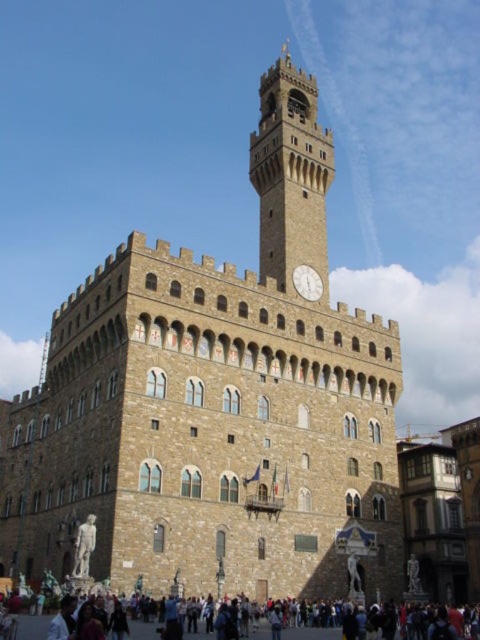
Looking at this image, can you confirm if brown stone clock tower at upper center is thinner than stone statue at lower left?

In fact, brown stone clock tower at upper center might be wider than stone statue at lower left.

Is brown stone clock tower at upper center further to the viewer compared to stone statue at lower left?

Yes, brown stone clock tower at upper center is further from the viewer.

The height and width of the screenshot is (640, 480). Identify the location of brown stone clock tower at upper center. click(291, 180).

Does point (314, 202) come behind point (25, 620)?

Yes, it is.

Does brown stone clock tower at upper center have a greater width compared to dark clothing at lower center?

No.

Where is `brown stone clock tower at upper center`? The width and height of the screenshot is (480, 640). brown stone clock tower at upper center is located at coordinates (291, 180).

Does dark clothing at lower center appear on the right side of white stone clock at center?

In fact, dark clothing at lower center is to the left of white stone clock at center.

Is dark clothing at lower center shorter than white stone clock at center?

Incorrect, dark clothing at lower center's height does not fall short of white stone clock at center's.

This screenshot has height=640, width=480. I want to click on dark clothing at lower center, so click(32, 627).

This screenshot has height=640, width=480. I want to click on dark clothing at lower center, so click(x=32, y=627).